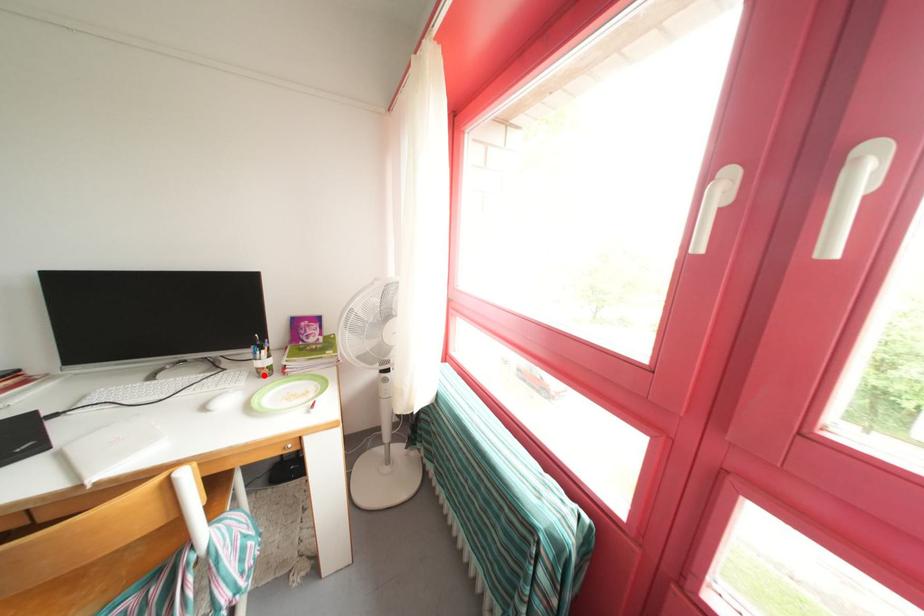
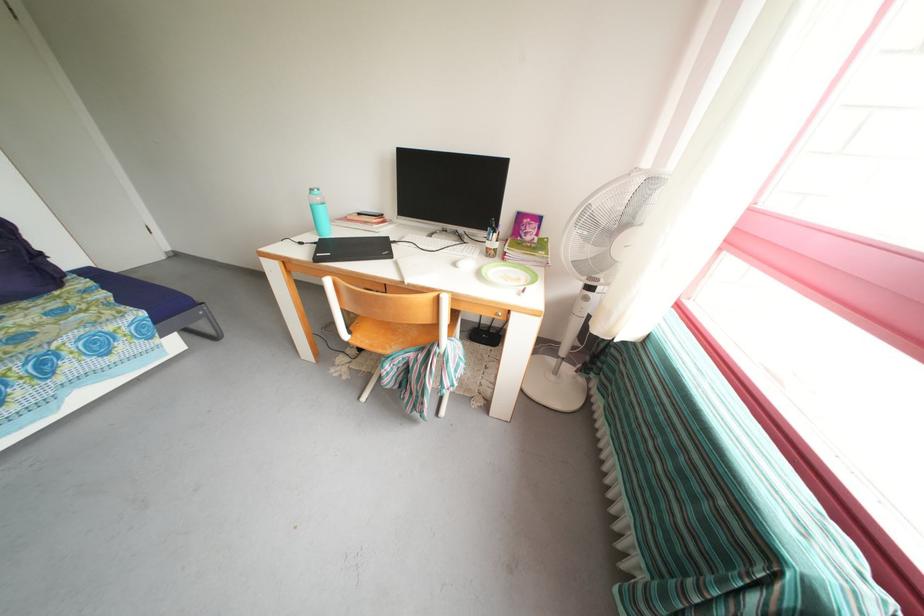
The point at the highlighted location is marked in the first image. Where is the corresponding point in the second image?

(494, 254)